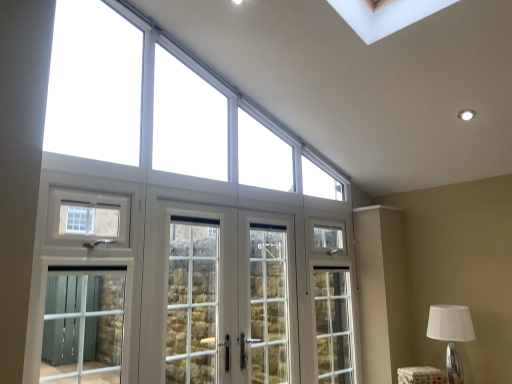
What do you see at coordinates (421, 375) in the screenshot? I see `white glossy fabric ottoman at lower right` at bounding box center [421, 375].

What do you see at coordinates (230, 297) in the screenshot?
I see `white glass doors at center, acting as the second screen door starting from the right` at bounding box center [230, 297].

Where is `white glass doors at center, which is counted as the 2th screen door, starting from the left`? white glass doors at center, which is counted as the 2th screen door, starting from the left is located at coordinates (230, 297).

Describe the element at coordinates (131, 95) in the screenshot. I see `white glass windows at upper center` at that location.

Locate an element on the screen. white glass windows at upper center is located at coordinates (131, 95).

You are a GUI agent. You are given a task and a screenshot of the screen. Output one action in this format:
    pyautogui.click(x=<x>, y=<y>)
    Task: Click on the clear glass door at center, the 1th screen door when ordered from right to left
    
    Given the screenshot: What is the action you would take?
    pyautogui.click(x=267, y=299)

Describe the element at coordinates (192, 301) in the screenshot. I see `white glass door at center, marked as the 3th screen door in a right-to-left arrangement` at that location.

What is the approximate width of white fabric lampshade at lower right?

12.81 inches.

What do you see at coordinates (453, 338) in the screenshot? This screenshot has width=512, height=384. I see `white fabric lampshade at lower right` at bounding box center [453, 338].

Where is `white glossy fabric ottoman at lower right`? Image resolution: width=512 pixels, height=384 pixels. white glossy fabric ottoman at lower right is located at coordinates (421, 375).

Is white glossy fabric ottoman at lower right positioned far away from white glass windows at upper center?

Yes, white glossy fabric ottoman at lower right is far from white glass windows at upper center.

How distant is white glossy fabric ottoman at lower right from white glass windows at upper center?

7.15 feet.

Who is smaller, white glossy fabric ottoman at lower right or white glass windows at upper center?

With smaller size is white glossy fabric ottoman at lower right.

From the image's perspective, which one is positioned higher, white glossy fabric ottoman at lower right or white glass windows at upper center?

white glass windows at upper center.

Which is closer, (176, 374) or (464, 329)?

The point (176, 374) is closer.

Which of these two, white glass door at center, marked as the 3th screen door in a right-to-left arrangement, or white fabric lampshade at lower right, stands taller?

white glass door at center, marked as the 3th screen door in a right-to-left arrangement.

Between white glass door at center, marked as the 3th screen door in a right-to-left arrangement, and white fabric lampshade at lower right, which one appears on the left side from the viewer's perspective?

white glass door at center, marked as the 3th screen door in a right-to-left arrangement, is more to the left.

How far apart are white glass door at center, marked as the 3th screen door in a right-to-left arrangement, and white fabric lampshade at lower right?

white glass door at center, marked as the 3th screen door in a right-to-left arrangement, and white fabric lampshade at lower right are 1.69 meters apart from each other.

Is white glass windows at upper center spatially inside clear glass door at center, the 1th screen door when ordered from right to left, or outside of it?

white glass windows at upper center is not enclosed by clear glass door at center, the 1th screen door when ordered from right to left.

Who is smaller, white glass windows at upper center or clear glass door at center, which appears as the 3th screen door when viewed from the left?

clear glass door at center, which appears as the 3th screen door when viewed from the left, is smaller.

Identify the location of window located in front of the clear glass door at center, the 1th screen door when ordered from right to left. (131, 95).

Is white glass windows at upper center positioned in front of clear glass door at center, the 1th screen door when ordered from right to left?

That is True.

Is white glass doors at center, which is counted as the 2th screen door, starting from the left, positioned behind white glossy fabric ottoman at lower right?

No, the depth of white glass doors at center, which is counted as the 2th screen door, starting from the left, is less than that of white glossy fabric ottoman at lower right.

Is white glass doors at center, which is counted as the 2th screen door, starting from the left, aimed at white glossy fabric ottoman at lower right?

No.

Is white glass doors at center, acting as the second screen door starting from the right, inside the boundaries of white glossy fabric ottoman at lower right, or outside?

white glass doors at center, acting as the second screen door starting from the right, is spatially situated outside white glossy fabric ottoman at lower right.

Does white glass doors at center, acting as the second screen door starting from the right, have a smaller size compared to white glossy fabric ottoman at lower right?

Actually, white glass doors at center, acting as the second screen door starting from the right, might be larger than white glossy fabric ottoman at lower right.

Is white fabric lampshade at lower right further to the viewer compared to white glass doors at center, which is counted as the 2th screen door, starting from the left?

Yes, it is behind white glass doors at center, which is counted as the 2th screen door, starting from the left.

Does white fabric lampshade at lower right have a greater width compared to white glass doors at center, acting as the second screen door starting from the right?

Indeed, white fabric lampshade at lower right has a greater width compared to white glass doors at center, acting as the second screen door starting from the right.

From the image's perspective, which is below, white fabric lampshade at lower right or white glass doors at center, acting as the second screen door starting from the right?

From the image's view, white fabric lampshade at lower right is below.

Which object is wider, white glass door at center, marked as the 3th screen door in a right-to-left arrangement, or clear glass door at center, the 1th screen door when ordered from right to left?

Wider between the two is clear glass door at center, the 1th screen door when ordered from right to left.

Which is more to the left, white glass door at center, arranged as the first screen door when viewed from the left, or clear glass door at center, the 1th screen door when ordered from right to left?

Positioned to the left is white glass door at center, arranged as the first screen door when viewed from the left.

Looking at this image, who is shorter, white glass door at center, marked as the 3th screen door in a right-to-left arrangement, or clear glass door at center, the 1th screen door when ordered from right to left?

With less height is white glass door at center, marked as the 3th screen door in a right-to-left arrangement.

From the image's perspective, between white glass door at center, marked as the 3th screen door in a right-to-left arrangement, and clear glass door at center, which appears as the 3th screen door when viewed from the left, which one is located above?

white glass door at center, marked as the 3th screen door in a right-to-left arrangement, is shown above in the image.

This screenshot has height=384, width=512. What are the coordinates of `the 1st screen door to the left of the white fabric lampshade at lower right, starting your count from the anchor` in the screenshot? It's located at (267, 299).

Considering the positions of objects clear glass door at center, the 1th screen door when ordered from right to left, and white fabric lampshade at lower right in the image provided, who is more to the right, clear glass door at center, the 1th screen door when ordered from right to left, or white fabric lampshade at lower right?

From the viewer's perspective, white fabric lampshade at lower right appears more on the right side.

Between clear glass door at center, which appears as the 3th screen door when viewed from the left, and white fabric lampshade at lower right, which one is positioned behind?

white fabric lampshade at lower right.

From the image's perspective, is clear glass door at center, which appears as the 3th screen door when viewed from the left, located above or below white fabric lampshade at lower right?

Based on their image positions, clear glass door at center, which appears as the 3th screen door when viewed from the left, is located above white fabric lampshade at lower right.

You are a GUI agent. You are given a task and a screenshot of the screen. Output one action in this format:
    pyautogui.click(x=<x>, y=<y>)
    Task: Click on the window in front of the white glossy fabric ottoman at lower right
    The width and height of the screenshot is (512, 384).
    Given the screenshot: What is the action you would take?
    pyautogui.click(x=131, y=95)

Where is `table lamp behind the white glass door at center, marked as the 3th screen door in a right-to-left arrangement`? This screenshot has height=384, width=512. table lamp behind the white glass door at center, marked as the 3th screen door in a right-to-left arrangement is located at coordinates (453, 338).

From the image, which object appears to be farther from white glass windows at upper center, white glass doors at center, which is counted as the 2th screen door, starting from the left, or white glass door at center, marked as the 3th screen door in a right-to-left arrangement?

white glass door at center, marked as the 3th screen door in a right-to-left arrangement, lies further to white glass windows at upper center than the other object.

From the image, which object appears to be nearer to white fabric lampshade at lower right, clear glass door at center, the 1th screen door when ordered from right to left, or white glass doors at center, acting as the second screen door starting from the right?

clear glass door at center, the 1th screen door when ordered from right to left, is positioned closer to the anchor white fabric lampshade at lower right.

Looking at the image, which one is located further to white glass windows at upper center, white fabric lampshade at lower right or white glass door at center, arranged as the first screen door when viewed from the left?

white fabric lampshade at lower right.

Based on their spatial positions, is white glossy fabric ottoman at lower right or clear glass door at center, which appears as the 3th screen door when viewed from the left, further from white glass windows at upper center?

Based on the image, white glossy fabric ottoman at lower right appears to be further to white glass windows at upper center.

Looking at the image, which one is located closer to clear glass door at center, the 1th screen door when ordered from right to left, white glass door at center, arranged as the first screen door when viewed from the left, or white glossy fabric ottoman at lower right?

Among the two, white glass door at center, arranged as the first screen door when viewed from the left, is located nearer to clear glass door at center, the 1th screen door when ordered from right to left.

Based on their spatial positions, is white glass windows at upper center or white glass doors at center, acting as the second screen door starting from the right, closer to clear glass door at center, which appears as the 3th screen door when viewed from the left?

white glass doors at center, acting as the second screen door starting from the right, lies closer to clear glass door at center, which appears as the 3th screen door when viewed from the left, than the other object.

Looking at the image, which one is located closer to white glass windows at upper center, clear glass door at center, the 1th screen door when ordered from right to left, or white glass doors at center, acting as the second screen door starting from the right?

white glass doors at center, acting as the second screen door starting from the right, is closer to white glass windows at upper center.

Considering their positions, is white glass door at center, marked as the 3th screen door in a right-to-left arrangement, positioned closer to white glass windows at upper center than white glossy fabric ottoman at lower right?

white glass door at center, marked as the 3th screen door in a right-to-left arrangement, is closer to white glass windows at upper center.

The height and width of the screenshot is (384, 512). I want to click on window between white glass door at center, marked as the 3th screen door in a right-to-left arrangement, and white fabric lampshade at lower right from left to right, so click(131, 95).

The width and height of the screenshot is (512, 384). I want to click on screen door situated between white glass doors at center, which is counted as the 2th screen door, starting from the left, and white fabric lampshade at lower right from left to right, so click(x=267, y=299).

At what (x,y) coordinates should I click in order to perform the action: click on furniture between white glass doors at center, acting as the second screen door starting from the right, and white fabric lampshade at lower right from left to right. Please return your answer as a coordinate pair (x, y). The height and width of the screenshot is (384, 512). Looking at the image, I should click on (421, 375).

At what (x,y) coordinates should I click in order to perform the action: click on screen door that lies between white glass windows at upper center and white glass doors at center, acting as the second screen door starting from the right, from top to bottom. Please return your answer as a coordinate pair (x, y). Looking at the image, I should click on click(192, 301).